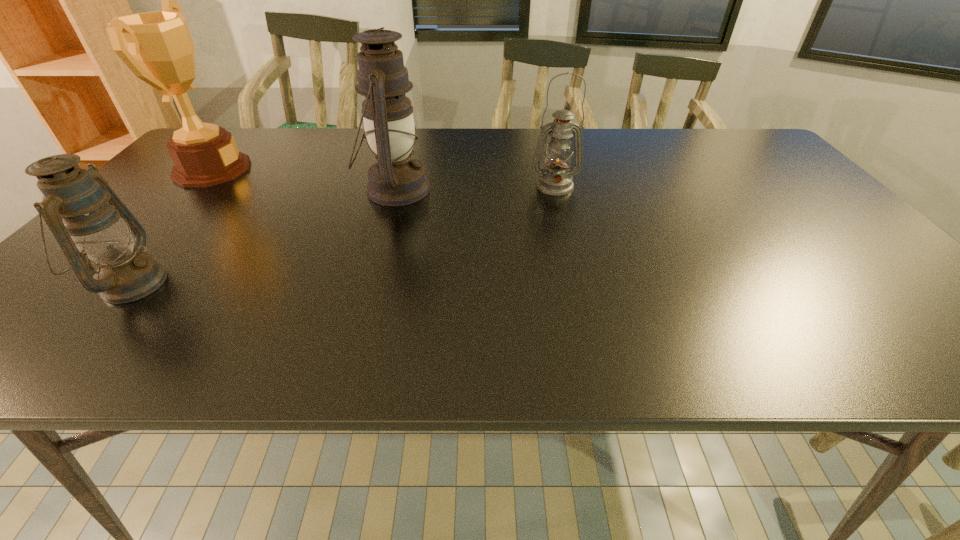
I want to click on oil lamp identified as the closest to the nearest oil lamp, so click(395, 179).

At what (x,y) coordinates should I click in order to perform the action: click on vacant area in the image that satisfies the following two spatial constraints: 1. on the front-facing side of the second object from right to left; 2. on the right side of the award. Please return your answer as a coordinate pair (x, y). The image size is (960, 540). Looking at the image, I should click on (194, 190).

You are a GUI agent. You are given a task and a screenshot of the screen. Output one action in this format:
    pyautogui.click(x=<x>, y=<y>)
    Task: Click on the vacant space that satisfies the following two spatial constraints: 1. on the front-facing side of the award; 2. on the right side of the tallest oil lamp
    
    Given the screenshot: What is the action you would take?
    pyautogui.click(x=194, y=190)

Where is `vacant point that satisfies the following two spatial constraints: 1. on the front-facing side of the leftmost oil lamp; 2. on the left side of the award`? The image size is (960, 540). vacant point that satisfies the following two spatial constraints: 1. on the front-facing side of the leftmost oil lamp; 2. on the left side of the award is located at coordinates (108, 284).

This screenshot has width=960, height=540. Find the location of `free space that satisfies the following two spatial constraints: 1. on the back side of the second oil lamp from right to left; 2. on the front-facing side of the award`. free space that satisfies the following two spatial constraints: 1. on the back side of the second oil lamp from right to left; 2. on the front-facing side of the award is located at coordinates (400, 170).

Where is `free space that satisfies the following two spatial constraints: 1. on the front-facing side of the award; 2. on the back side of the rightmost object`? The image size is (960, 540). free space that satisfies the following two spatial constraints: 1. on the front-facing side of the award; 2. on the back side of the rightmost object is located at coordinates (197, 186).

Where is `free space that satisfies the following two spatial constraints: 1. on the front-facing side of the rightmost oil lamp; 2. on the left side of the award`? The height and width of the screenshot is (540, 960). free space that satisfies the following two spatial constraints: 1. on the front-facing side of the rightmost oil lamp; 2. on the left side of the award is located at coordinates (197, 186).

Image resolution: width=960 pixels, height=540 pixels. In order to click on free space that satisfies the following two spatial constraints: 1. on the front-facing side of the second oil lamp from left to right; 2. on the left side of the award in this screenshot , I will do tap(194, 190).

Identify the location of blank area in the image that satisfies the following two spatial constraints: 1. on the back side of the rightmost object; 2. on the right side of the nearest oil lamp. (215, 186).

Locate an element on the screen. vacant point that satisfies the following two spatial constraints: 1. on the front-facing side of the rightmost object; 2. on the right side of the award is located at coordinates coord(197,186).